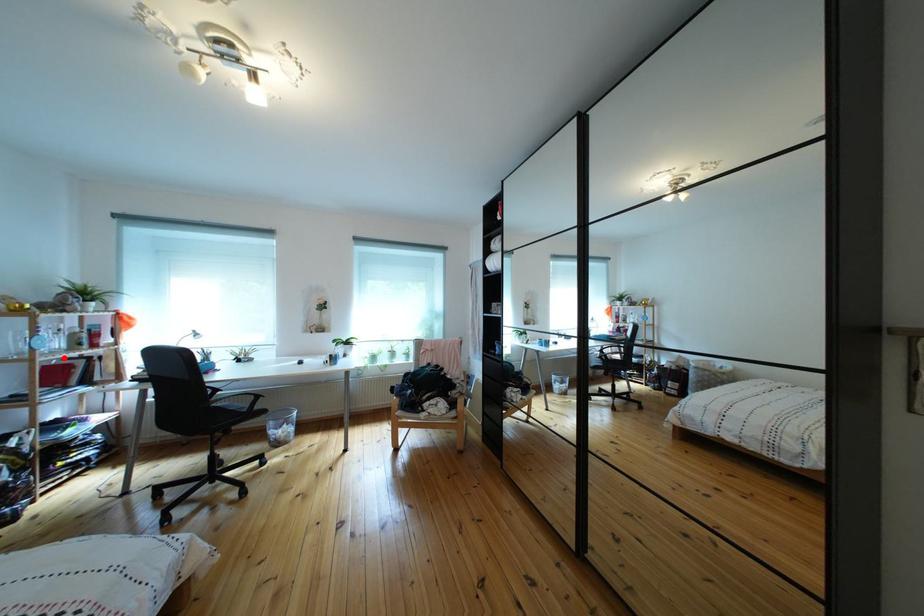
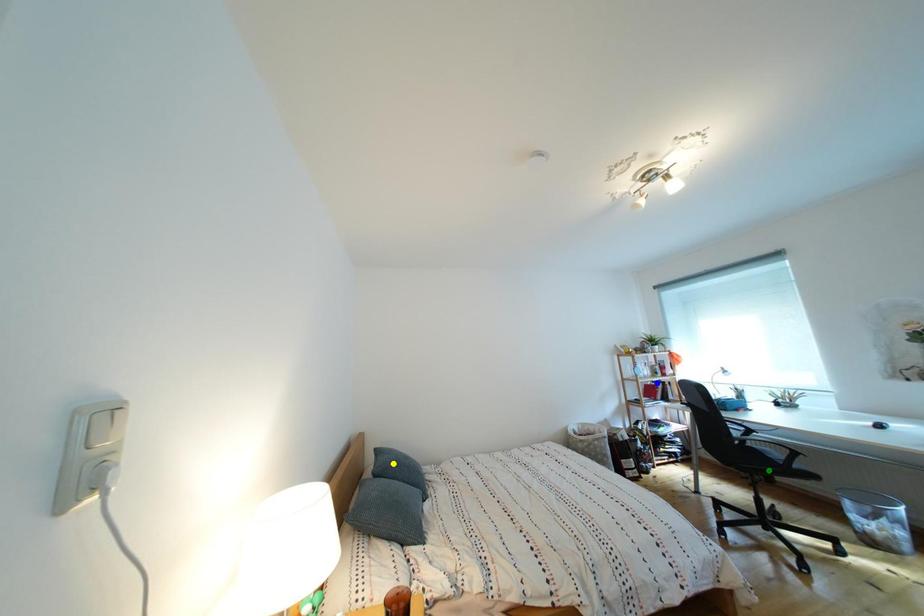
Question: I am providing you with two images of the same scene from different viewpoints. A red point is marked on the first image. You are given multiple points on the second image. Can you choose the point in image 2 that corresponds to the point in image 1?

Choices:
 (A) green point
 (B) yellow point
 (C) blue point

Answer: (C)